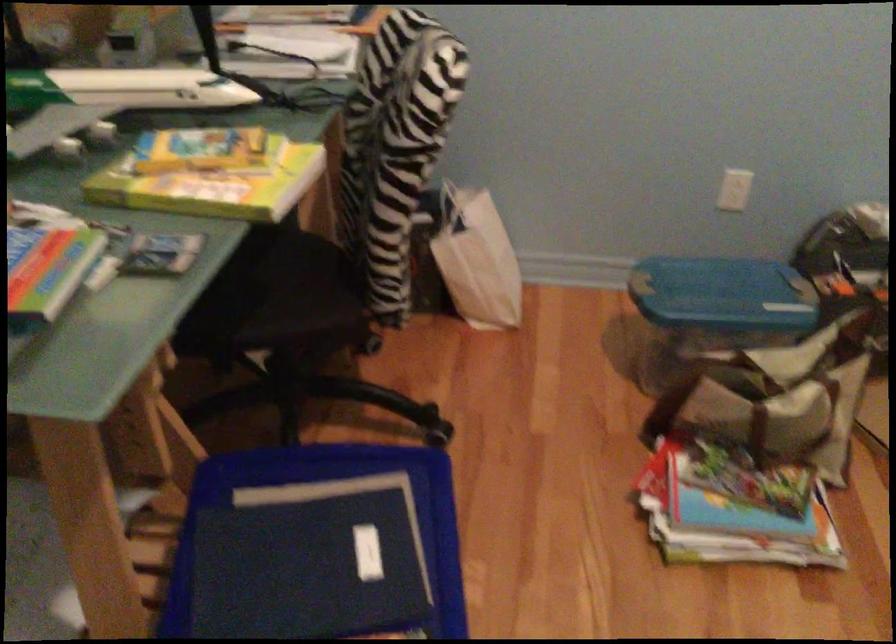
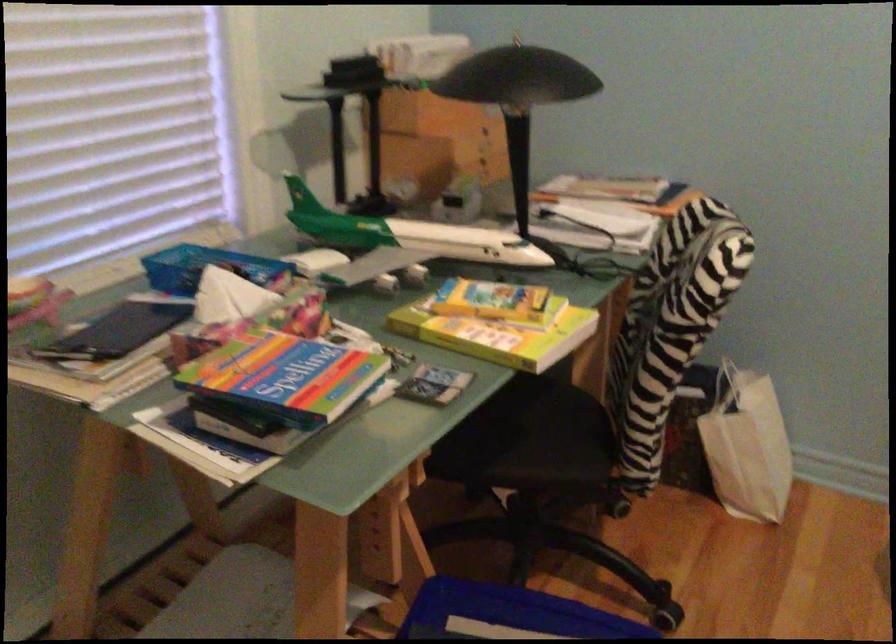
The point at (480, 261) is marked in the first image. Where is the corresponding point in the second image?

(746, 446)